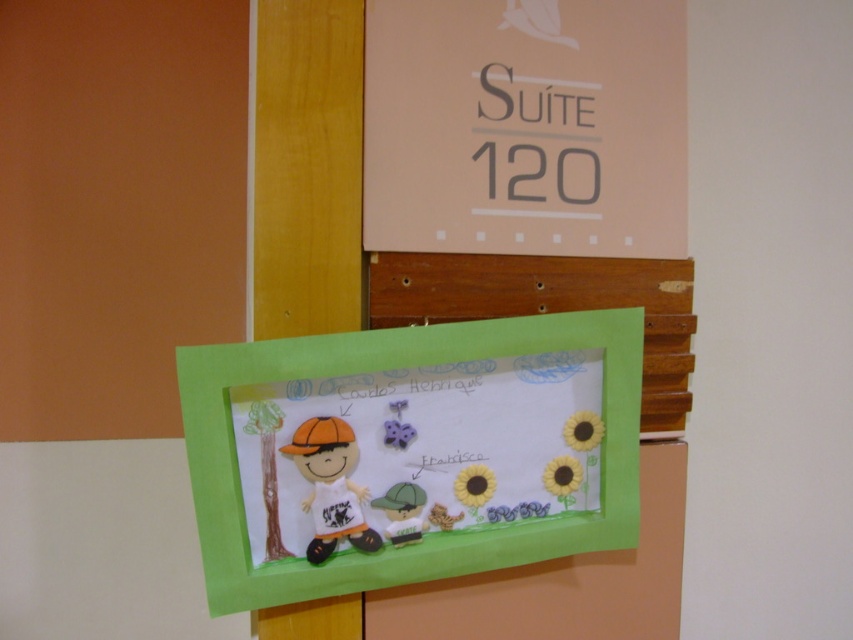
Who is positioned more to the right, matte green paperboard at center or green paperboard at center?

From the viewer's perspective, green paperboard at center appears more on the right side.

Which is above, matte green paperboard at center or green paperboard at center?

green paperboard at center is above.

Describe the element at coordinates (410, 452) in the screenshot. I see `matte green paperboard at center` at that location.

Find the location of a particular element. matte green paperboard at center is located at coordinates (410, 452).